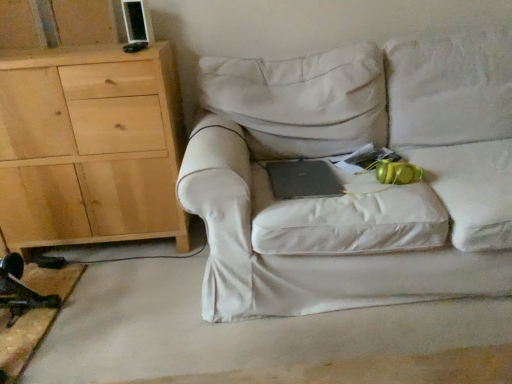
Question: Is black matte laptop at center located within white fabric couch at center?

Choices:
 (A) yes
 (B) no

Answer: (A)

Question: Is the position of white fabric couch at center more distant than that of black matte laptop at center?

Choices:
 (A) no
 (B) yes

Answer: (A)

Question: From the image's perspective, does white fabric couch at center appear higher than black matte laptop at center?

Choices:
 (A) yes
 (B) no

Answer: (A)

Question: Is white fabric couch at center oriented away from black matte laptop at center?

Choices:
 (A) no
 (B) yes

Answer: (B)

Question: Does white fabric couch at center lie in front of black matte laptop at center?

Choices:
 (A) yes
 (B) no

Answer: (A)

Question: Considering the positions of natural wood cabinet at left and white fabric couch at center in the image, is natural wood cabinet at left wider or thinner than white fabric couch at center?

Choices:
 (A) thin
 (B) wide

Answer: (A)

Question: From a real-world perspective, is natural wood cabinet at left physically located above or below white fabric couch at center?

Choices:
 (A) above
 (B) below

Answer: (A)

Question: Is natural wood cabinet at left situated inside white fabric couch at center or outside?

Choices:
 (A) outside
 (B) inside

Answer: (A)

Question: From the image's perspective, is natural wood cabinet at left located above or below white fabric couch at center?

Choices:
 (A) below
 (B) above

Answer: (B)

Question: In terms of height, does black matte laptop at center look taller or shorter compared to white fabric couch at center?

Choices:
 (A) tall
 (B) short

Answer: (B)

Question: Is point (320, 178) positioned closer to the camera than point (431, 261)?

Choices:
 (A) farther
 (B) closer

Answer: (A)

Question: Is black matte laptop at center inside the boundaries of white fabric couch at center, or outside?

Choices:
 (A) inside
 (B) outside

Answer: (A)

Question: Based on their positions, is black matte laptop at center located to the left or right of white fabric couch at center?

Choices:
 (A) left
 (B) right

Answer: (A)

Question: Is white fabric couch at center wider or thinner than black matte laptop at center?

Choices:
 (A) thin
 (B) wide

Answer: (B)

Question: From a real-world perspective, is white fabric couch at center above or below black matte laptop at center?

Choices:
 (A) below
 (B) above

Answer: (B)